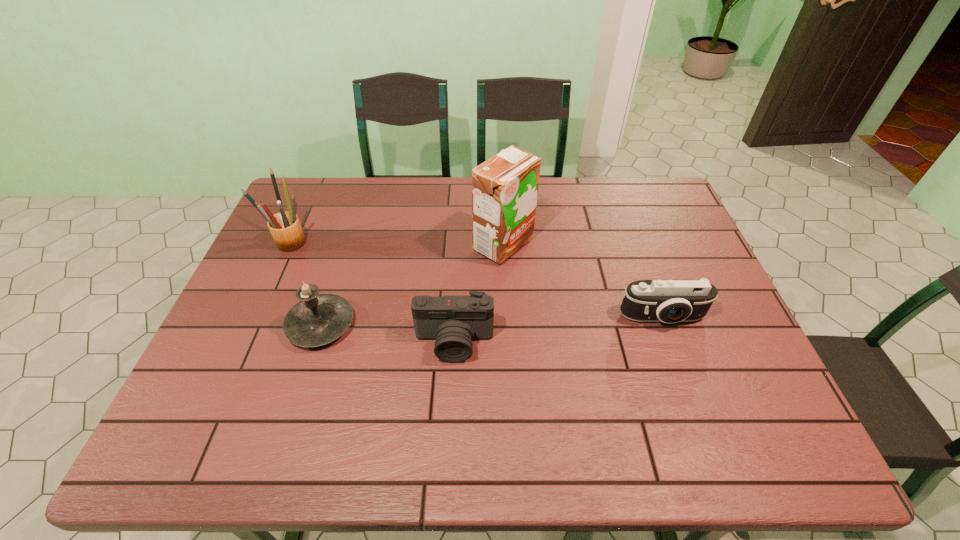
Locate an element on the screen. The image size is (960, 540). empty location between the candle and the tallest object is located at coordinates (412, 285).

Locate an element on the screen. The width and height of the screenshot is (960, 540). object that is the third nearest to the right camera is located at coordinates (318, 319).

Find the location of a particular element. This screenshot has height=540, width=960. object that is the fourth closest to the rightmost object is located at coordinates (285, 227).

The image size is (960, 540). I want to click on blank area in the image that satisfies the following two spatial constraints: 1. on the straw side of the tallest object; 2. at the lens of the left camera, so click(509, 343).

The image size is (960, 540). Find the location of `free location that satisfies the following two spatial constraints: 1. on the straw side of the carton; 2. at the lens of the left camera`. free location that satisfies the following two spatial constraints: 1. on the straw side of the carton; 2. at the lens of the left camera is located at coordinates (509, 343).

Locate an element on the screen. free region that satisfies the following two spatial constraints: 1. on the straw side of the carton; 2. at the lens of the left camera is located at coordinates (509, 343).

The width and height of the screenshot is (960, 540). I want to click on free location that satisfies the following two spatial constraints: 1. on the straw side of the tallest object; 2. on the front side of the candle, so (508, 325).

Locate an element on the screen. free space that satisfies the following two spatial constraints: 1. on the straw side of the carton; 2. at the lens of the left camera is located at coordinates (509, 343).